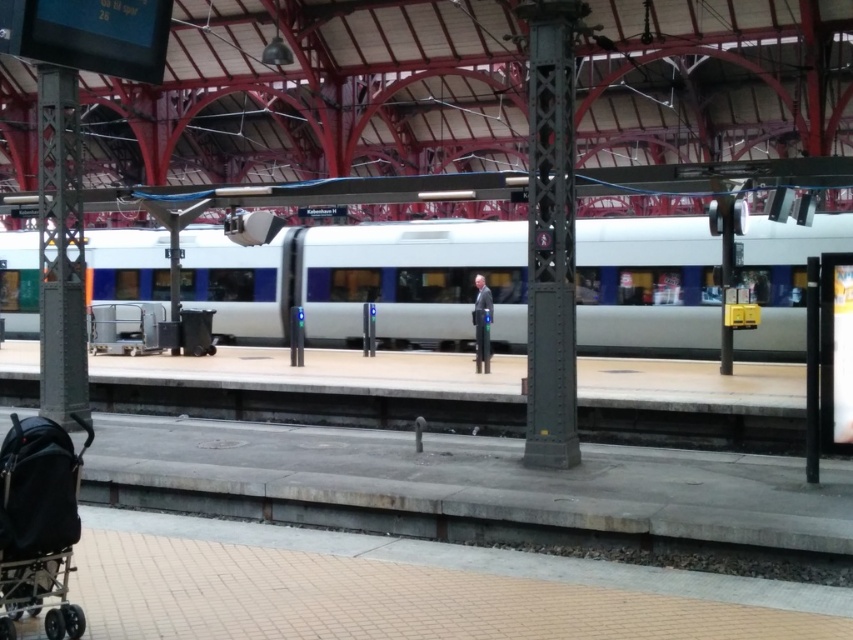
Consider the image. You are standing at the train station platform and want to take a photo of the point marked at coordinates point (42,536). The camera you are using has a maximum focus range of 4 meters. Will the camera be able to focus on the point?

The point (42,536) is 4.44 meters from the camera, which exceeds the camera maximum focus range of 4 meters. Therefore, the camera will not be able to focus on the point.

You are a passenger waiting at the train station. You notice both the silver metallic train at center and the light blue fabric jacket at center. Which object is closer to you?

The silver metallic train at center is closer to you because it is in front of the light blue fabric jacket at center.